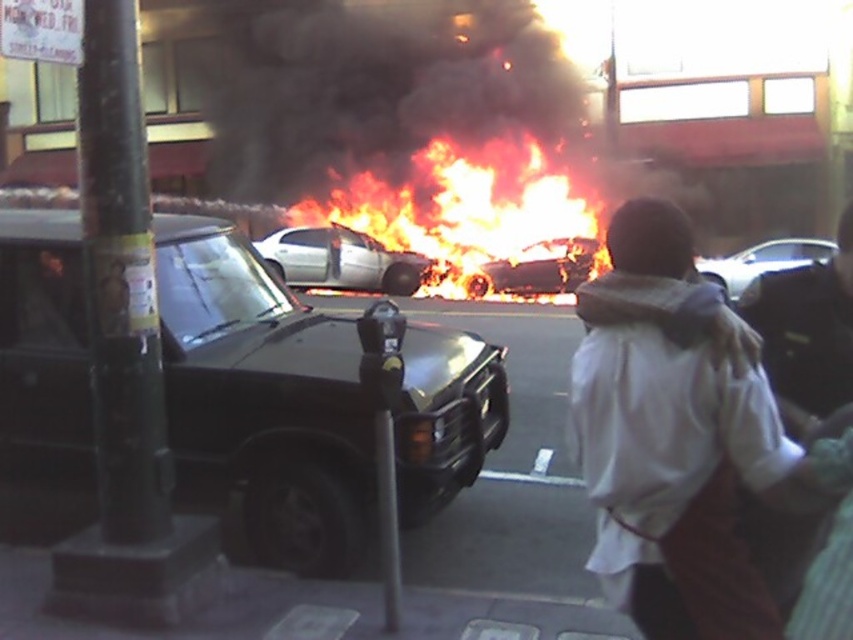
Question: Which object is positioned farthest from the flaming car at center?

Choices:
 (A) silver metallic sedan at center
 (B) metallic gray parking meter at center
 (C) shiny black jeep at left

Answer: (B)

Question: Among these objects, which one is farthest from the camera?

Choices:
 (A) flaming car at center
 (B) metallic gray parking meter at center
 (C) silver metallic sedan at center
 (D) white cotton hoodie at center

Answer: (A)

Question: Can you confirm if white cotton hoodie at center is positioned below metallic gray parking meter at center?

Choices:
 (A) yes
 (B) no

Answer: (B)

Question: Considering the real-world distances, which object is farthest from the shiny black jeep at left?

Choices:
 (A) flaming car at center
 (B) charred metal car at center

Answer: (A)

Question: Is shiny black jeep at left wider than metallic gray parking meter at center?

Choices:
 (A) no
 (B) yes

Answer: (B)

Question: Does shiny black jeep at left appear under metallic gray parking meter at center?

Choices:
 (A) no
 (B) yes

Answer: (A)